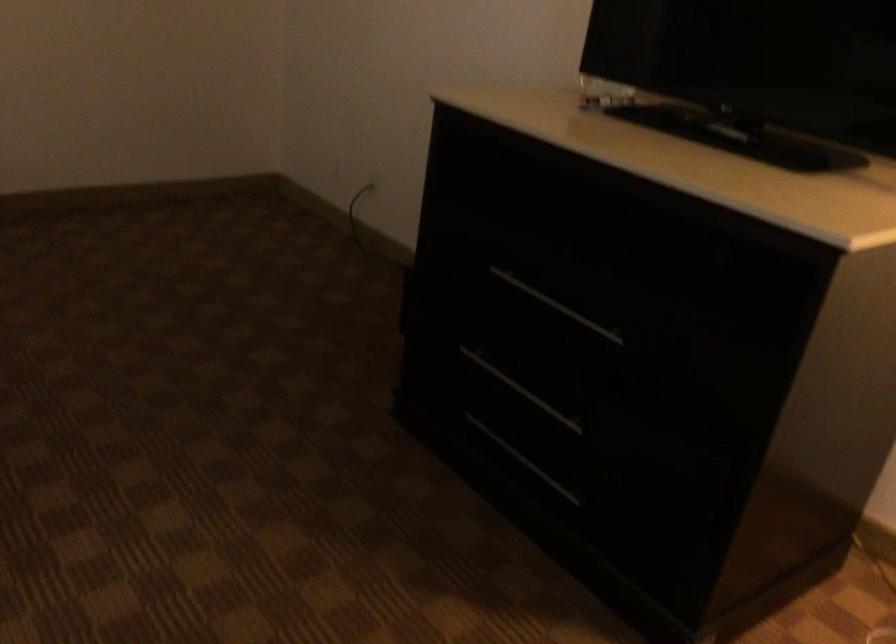
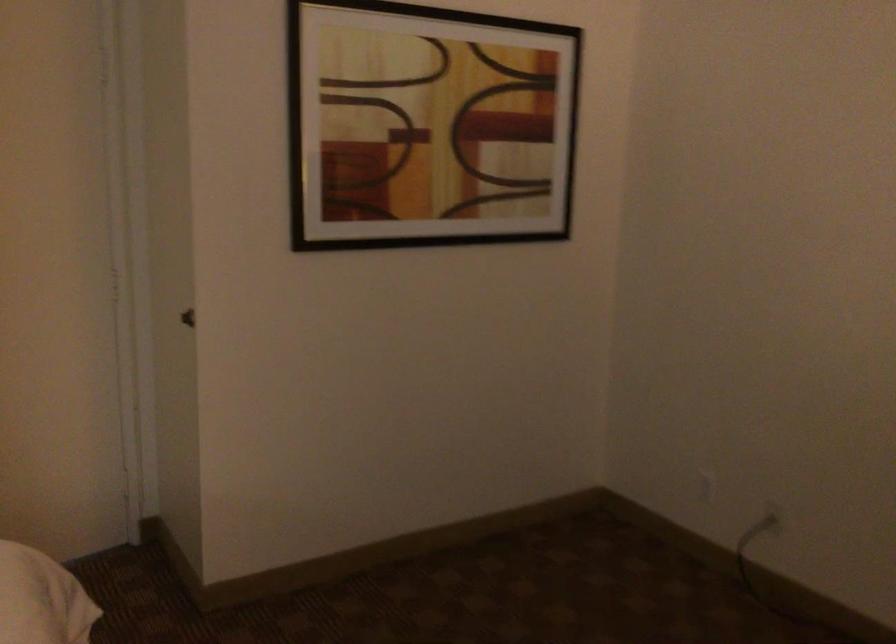
Locate, in the second image, the point that corresponds to (x=349, y=165) in the first image.

(707, 487)